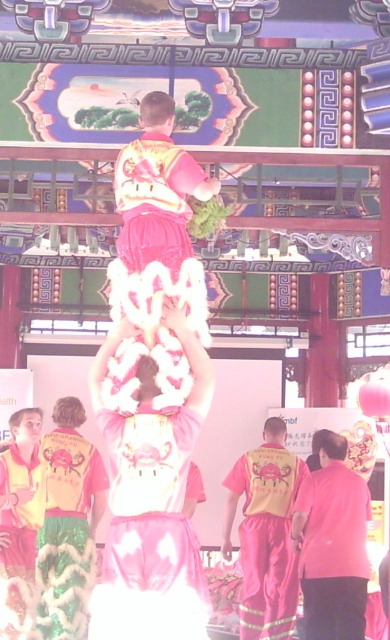
In the scene shown: You are a photographer at the cultural performance. You want to take a photo focusing on the pink satin costume at center and the pink fabric at center. Which object will appear larger in the photo?

The pink satin costume at center will appear larger in the photo because it is closer to the viewer than the pink fabric at center.

You are a photographer positioned at the center of the scene. You want to capture a closeup shot of the yellow reflective fabric pants at center. What is the exact coordinate where you should focus your camera?

The exact coordinate to focus your camera is at point (265, 532).